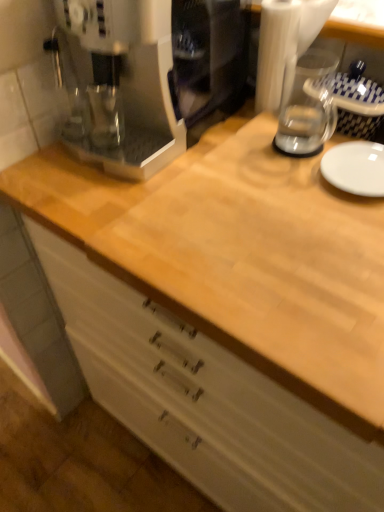
Question: Is white glossy plate at right positioned with its back to transparent glass blender at upper right?

Choices:
 (A) no
 (B) yes

Answer: (A)

Question: Considering the relative sizes of white glossy plate at right and transparent glass blender at upper right in the image provided, is white glossy plate at right smaller than transparent glass blender at upper right?

Choices:
 (A) no
 (B) yes

Answer: (B)

Question: Is white glossy plate at right taller than transparent glass blender at upper right?

Choices:
 (A) no
 (B) yes

Answer: (A)

Question: Is white glossy plate at right oriented towards transparent glass blender at upper right?

Choices:
 (A) yes
 (B) no

Answer: (B)

Question: Can you confirm if white glossy plate at right is bigger than transparent glass blender at upper right?

Choices:
 (A) yes
 (B) no

Answer: (B)

Question: Choose the correct answer: Is white glossy plate at right inside natural wood cabinet at center or outside it?

Choices:
 (A) outside
 (B) inside

Answer: (B)

Question: Is point (357, 189) positioned closer to the camera than point (183, 402)?

Choices:
 (A) farther
 (B) closer

Answer: (B)

Question: In terms of height, does white glossy plate at right look taller or shorter compared to natural wood cabinet at center?

Choices:
 (A) tall
 (B) short

Answer: (B)

Question: Looking at the image, does white glossy plate at right seem bigger or smaller compared to natural wood cabinet at center?

Choices:
 (A) small
 (B) big

Answer: (A)

Question: In terms of size, does natural wood cabinet at center appear bigger or smaller than white glossy plate at right?

Choices:
 (A) small
 (B) big

Answer: (B)

Question: Would you say natural wood cabinet at center is inside or outside white glossy plate at right?

Choices:
 (A) inside
 (B) outside

Answer: (B)

Question: Is natural wood cabinet at center in front of or behind white glossy plate at right in the image?

Choices:
 (A) front
 (B) behind

Answer: (A)

Question: Considering the positions of natural wood cabinet at center and white glossy plate at right in the image, is natural wood cabinet at center wider or thinner than white glossy plate at right?

Choices:
 (A) wide
 (B) thin

Answer: (A)

Question: Would you say transparent glass blender at upper right is inside or outside white glossy plate at right?

Choices:
 (A) inside
 (B) outside

Answer: (B)

Question: In terms of height, does transparent glass blender at upper right look taller or shorter compared to white glossy plate at right?

Choices:
 (A) short
 (B) tall

Answer: (B)